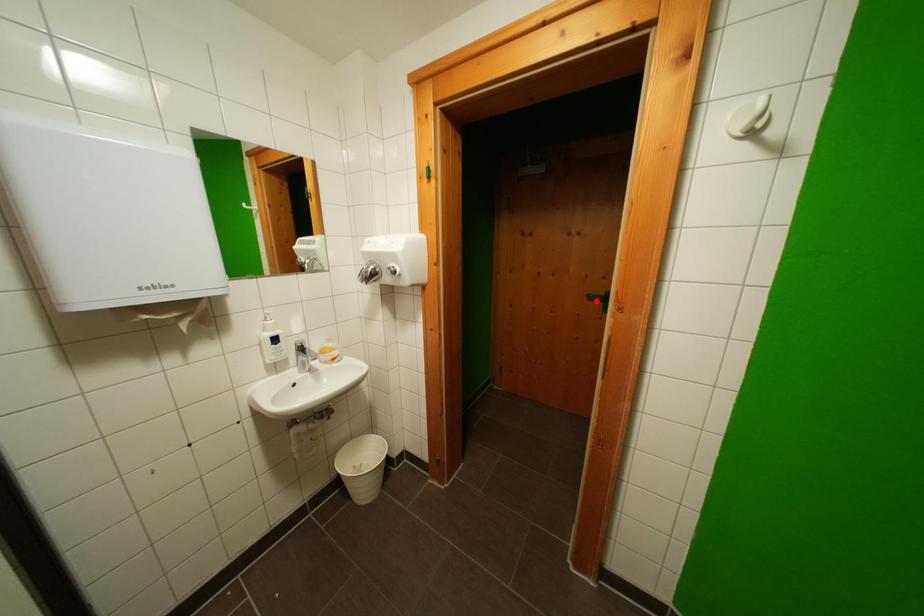
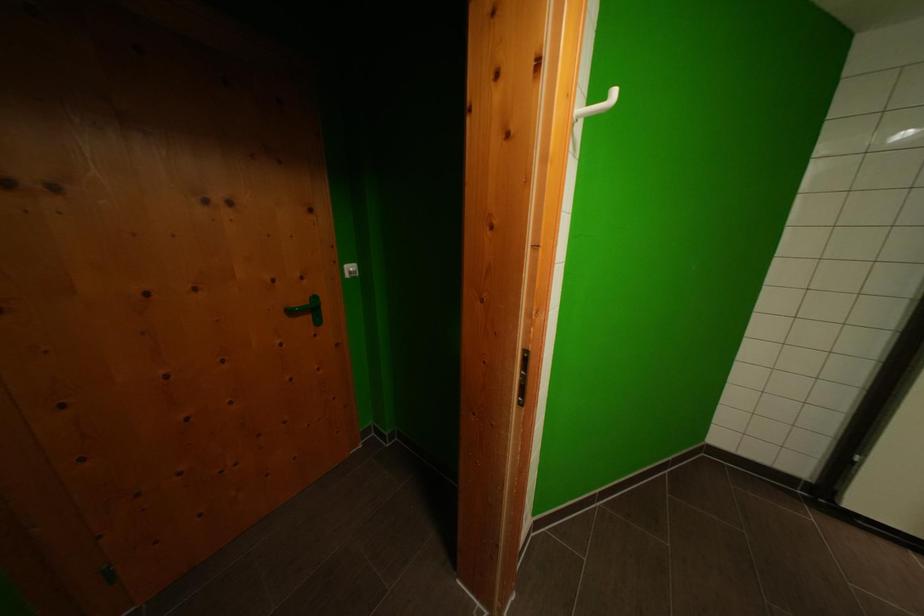
Locate, in the second image, the point that corresponds to the highlighted location in the first image.

(297, 315)